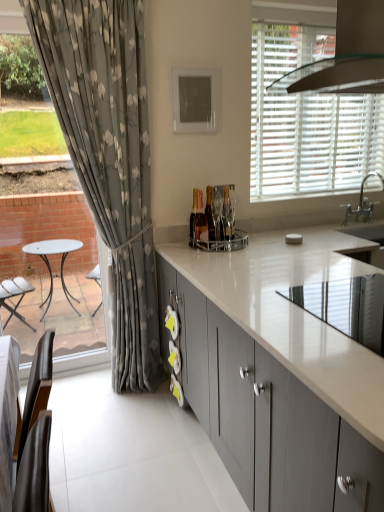
What do you see at coordinates (108, 156) in the screenshot?
I see `fluffy gray curtain at left` at bounding box center [108, 156].

In order to face white glossy sink at upper right, should I rotate leftwards or rightwards?

A 21.724 degree turn to the right will do.

The image size is (384, 512). I want to click on clear glass exhaust hood at upper right, so click(345, 55).

Who is smaller, matte gray cabinets at center or white glossy countertop at center?

With smaller size is white glossy countertop at center.

Could you tell me if matte gray cabinets at center is turned towards white glossy countertop at center?

No, matte gray cabinets at center is not facing towards white glossy countertop at center.

Would you say white glossy countertop at center is part of matte gray cabinets at center's contents?

Yes.

Is matte gray cabinets at center in front of or behind white glossy countertop at center in the image?

Clearly, matte gray cabinets at center is in front of white glossy countertop at center.

Is white matte blinds at upper right positioned far away from white glossy countertop at center?

white matte blinds at upper right is positioned a significant distance from white glossy countertop at center.

Which point is more distant from viewer, (342, 186) or (367, 306)?

Positioned behind is point (342, 186).

From the image's perspective, is white matte blinds at upper right located above or below white glossy countertop at center?

Based on their image positions, white matte blinds at upper right is located above white glossy countertop at center.

Based on their sizes in the image, would you say white matte blinds at upper right is bigger or smaller than white glossy countertop at center?

Considering their sizes, white matte blinds at upper right takes up more space than white glossy countertop at center.

Based on the photo, can you tell me how much clear glass exhaust hood at upper right and white matte blinds at upper right differ in facing direction?

There is a 88.9-degree angle between the facing directions of clear glass exhaust hood at upper right and white matte blinds at upper right.

From a real-world perspective, is clear glass exhaust hood at upper right physically above white matte blinds at upper right?

Yes, from a real-world perspective, clear glass exhaust hood at upper right is over white matte blinds at upper right

Which point is more forward, (269, 91) or (271, 174)?

Positioned in front is point (269, 91).

Image resolution: width=384 pixels, height=512 pixels. I want to click on exhaust hood located in front of the white matte blinds at upper right, so click(x=345, y=55).

Looking at their sizes, would you say white matte blinds at upper right is wider or thinner than clear glass exhaust hood at upper right?

Clearly, white matte blinds at upper right has less width compared to clear glass exhaust hood at upper right.

Is white matte blinds at upper right turned away from clear glass exhaust hood at upper right?

No.

Which object is further away from the camera taking this photo, white matte blinds at upper right or matte gray cabinets at center?

white matte blinds at upper right is further from the camera.

From the image's perspective, who appears lower, white matte blinds at upper right or matte gray cabinets at center?

matte gray cabinets at center, from the image's perspective.

Where is `cabinetry beneath the white matte blinds at upper right (from a real-world perspective)`? This screenshot has width=384, height=512. cabinetry beneath the white matte blinds at upper right (from a real-world perspective) is located at coordinates (278, 371).

Is the surface of white matte blinds at upper right in direct contact with matte gray cabinets at center?

No, white matte blinds at upper right is not next to matte gray cabinets at center.

Is matte gray cabinets at center facing away from clear glass exhaust hood at upper right?

No, matte gray cabinets at center is not facing the opposite direction of clear glass exhaust hood at upper right.

Is matte gray cabinets at center not close to clear glass exhaust hood at upper right?

Yes, matte gray cabinets at center and clear glass exhaust hood at upper right are located far from each other.

Is clear glass exhaust hood at upper right completely or partially inside matte gray cabinets at center?

Actually, clear glass exhaust hood at upper right is outside matte gray cabinets at center.

Considering the positions of objects matte gray cabinets at center and clear glass exhaust hood at upper right in the image provided, who is more to the left, matte gray cabinets at center or clear glass exhaust hood at upper right?

Positioned to the left is matte gray cabinets at center.

Does point (359, 325) lie behind point (367, 178)?

That is False.

Is white glossy countertop at center bigger than white glossy sink at upper right?

Incorrect, white glossy countertop at center is not larger than white glossy sink at upper right.

Is white glossy countertop at center facing away from white glossy sink at upper right?

white glossy countertop at center is not turned away from white glossy sink at upper right.

Would you say white glossy countertop at center is to the left or to the right of white glossy sink at upper right in the picture?

Clearly, white glossy countertop at center is on the left of white glossy sink at upper right in the image.

This screenshot has height=512, width=384. I want to click on appliance above the matte gray cabinets at center (from a real-world perspective), so click(x=347, y=307).

Find the location of a particular element. The image size is (384, 512). appliance on the left of white matte blinds at upper right is located at coordinates (347, 307).

From the image, which object appears to be nearer to clear glass exhaust hood at upper right, fluffy gray curtain at left or white matte blinds at upper right?

white matte blinds at upper right is positioned closer to the anchor clear glass exhaust hood at upper right.

Looking at the image, which one is located closer to white glossy sink at upper right, fluffy gray curtain at left or clear glass exhaust hood at upper right?

clear glass exhaust hood at upper right is positioned closer to the anchor white glossy sink at upper right.

When comparing their distances from white glossy countertop at center, does matte gray cabinets at center or fluffy gray curtain at left seem closer?

Based on the image, matte gray cabinets at center appears to be nearer to white glossy countertop at center.

Looking at the image, which one is located closer to matte gray cabinets at center, clear glass exhaust hood at upper right or fluffy gray curtain at left?

fluffy gray curtain at left is closer to matte gray cabinets at center.

Which object lies further to the anchor point fluffy gray curtain at left, clear glass exhaust hood at upper right or matte gray cabinets at center?

clear glass exhaust hood at upper right is further to fluffy gray curtain at left.

When comparing their distances from fluffy gray curtain at left, does matte gray cabinets at center or clear glass exhaust hood at upper right seem further?

clear glass exhaust hood at upper right is positioned further to the anchor fluffy gray curtain at left.

From the picture: Considering their positions, is white glossy countertop at center positioned further to fluffy gray curtain at left than clear glass exhaust hood at upper right?

clear glass exhaust hood at upper right lies further to fluffy gray curtain at left than the other object.

Which object lies further to the anchor point white glossy countertop at center, white glossy sink at upper right or fluffy gray curtain at left?

white glossy sink at upper right is further to white glossy countertop at center.

You are a GUI agent. You are given a task and a screenshot of the screen. Output one action in this format:
    pyautogui.click(x=<x>, y=<y>)
    Task: Click on the window positioned between white glossy countertop at center and white glossy sink at upper right from near to far
    This screenshot has width=384, height=512.
    Given the screenshot: What is the action you would take?
    pyautogui.click(x=306, y=111)

Identify the location of exhaust hood situated between fluffy gray curtain at left and white glossy countertop at center from left to right. (345, 55).

At what (x,y) coordinates should I click in order to perform the action: click on window positioned between matte gray cabinets at center and white glossy sink at upper right from near to far. Please return your answer as a coordinate pair (x, y). Looking at the image, I should click on (306, 111).

Where is `curtain positioned between clear glass exhaust hood at upper right and white glossy sink at upper right from near to far`? curtain positioned between clear glass exhaust hood at upper right and white glossy sink at upper right from near to far is located at coordinates (108, 156).